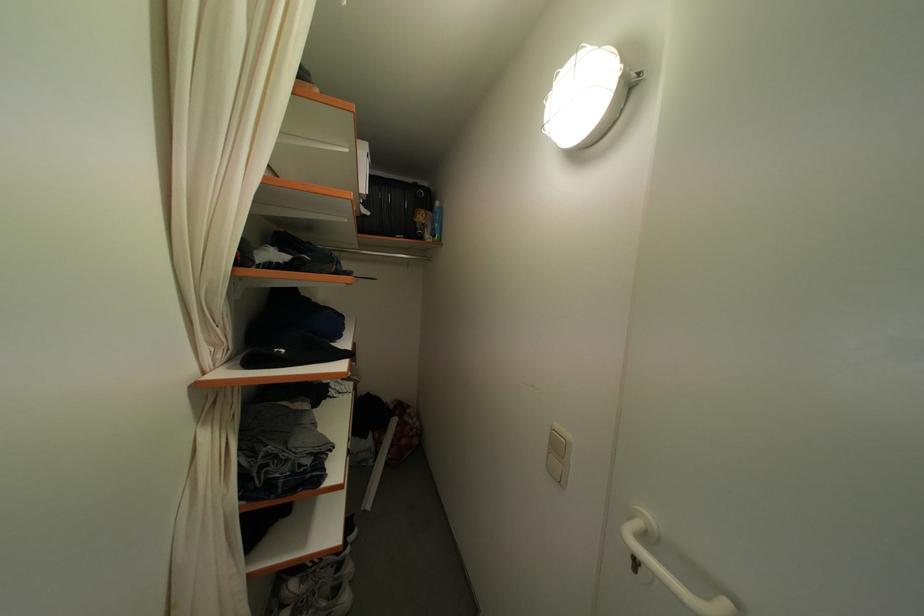
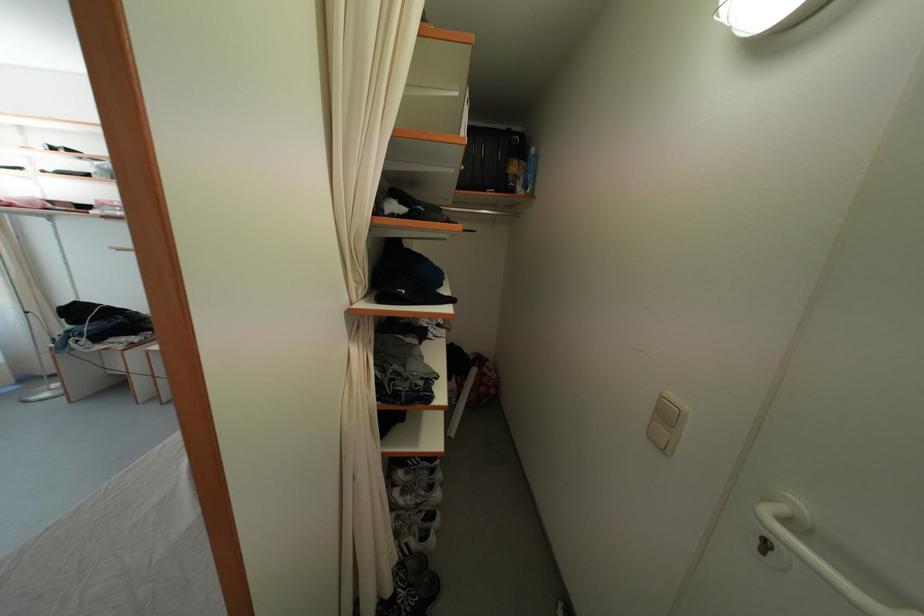
In the second image, find the point that corresponds to (x=646, y=531) in the first image.

(787, 515)